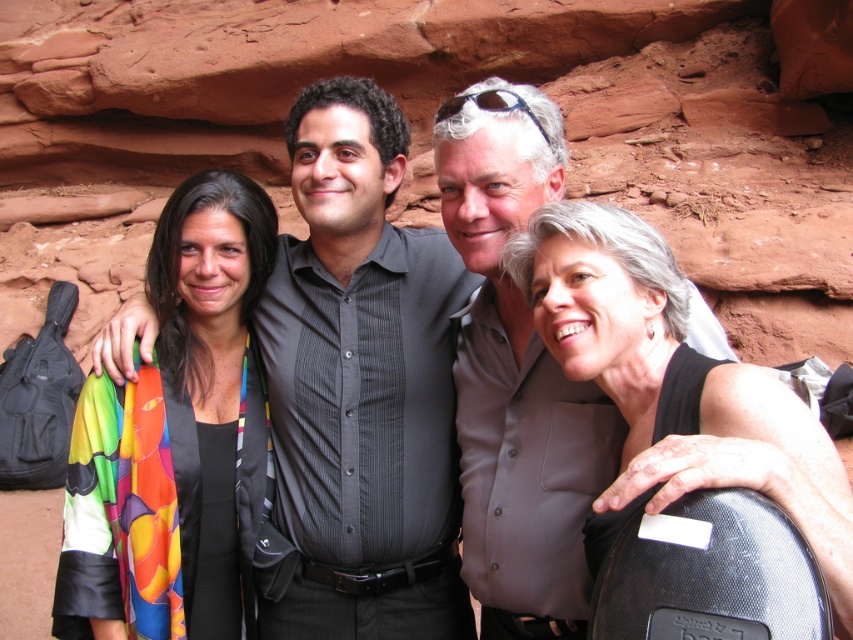
Can you confirm if gray matte shirt at center is positioned to the right of black matte tank top at right?

No, gray matte shirt at center is not to the right of black matte tank top at right.

You are a GUI agent. You are given a task and a screenshot of the screen. Output one action in this format:
    pyautogui.click(x=<x>, y=<y>)
    Task: Click on the gray matte shirt at center
    This screenshot has width=853, height=640.
    Given the screenshot: What is the action you would take?
    pyautogui.click(x=515, y=376)

In order to click on gray matte shirt at center in this screenshot , I will do `click(515, 376)`.

Find the location of a particular element. This screenshot has width=853, height=640. gray matte shirt at center is located at coordinates (515, 376).

Is multicolored fabric scarf at left taller than gray matte shirt at center?

No.

Between multicolored fabric scarf at left and gray matte shirt at center, which one appears on the right side from the viewer's perspective?

gray matte shirt at center

Which is behind, point (224, 604) or point (523, 406)?

The point (224, 604) is more distant.

Where is `multicolored fabric scarf at left`? This screenshot has width=853, height=640. multicolored fabric scarf at left is located at coordinates (175, 436).

Is dark gray striped shirt at center thinner than black matte tank top at right?

Incorrect, dark gray striped shirt at center's width is not less than black matte tank top at right's.

Is point (405, 442) less distant than point (698, 378)?

No, (405, 442) is further to viewer.

Does point (322, 134) lie behind point (556, 218)?

That is True.

Find the location of `dark gray striped shirt at center`. dark gray striped shirt at center is located at coordinates (363, 385).